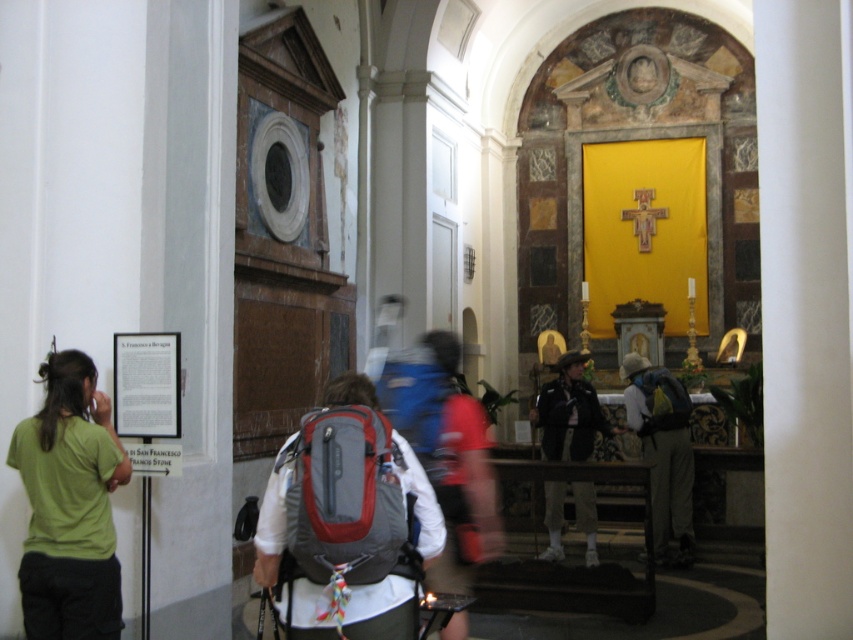
Question: Does black leather jacket at center appear on the left side of matte gray backpack at center?

Choices:
 (A) no
 (B) yes

Answer: (B)

Question: Based on their relative distances, which object is nearer to the red fabric backpack at center?

Choices:
 (A) black leather jacket at center
 (B) green matte shirt at left
 (C) yellow fabric backpack at center

Answer: (B)

Question: Does red fabric backpack at center have a greater width compared to matte gray backpack at center?

Choices:
 (A) no
 (B) yes

Answer: (B)

Question: Is gray fabric backpack at center wider than matte gray backpack at center?

Choices:
 (A) yes
 (B) no

Answer: (A)

Question: Which of the following is the farthest from the observer?

Choices:
 (A) (659, 428)
 (B) (25, 563)

Answer: (A)

Question: Among these points, which one is nearest to the camera?

Choices:
 (A) (654, 372)
 (B) (88, 536)
 (C) (683, 426)

Answer: (B)